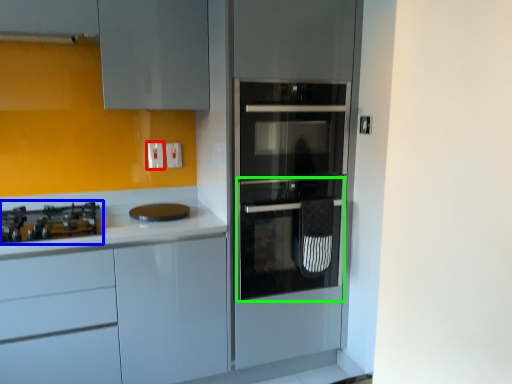
Question: Which object is positioned farthest from electric outlet (highlighted by a red box)? Select from gas stove (highlighted by a blue box) and oven (highlighted by a green box).

Choices:
 (A) gas stove
 (B) oven

Answer: (B)